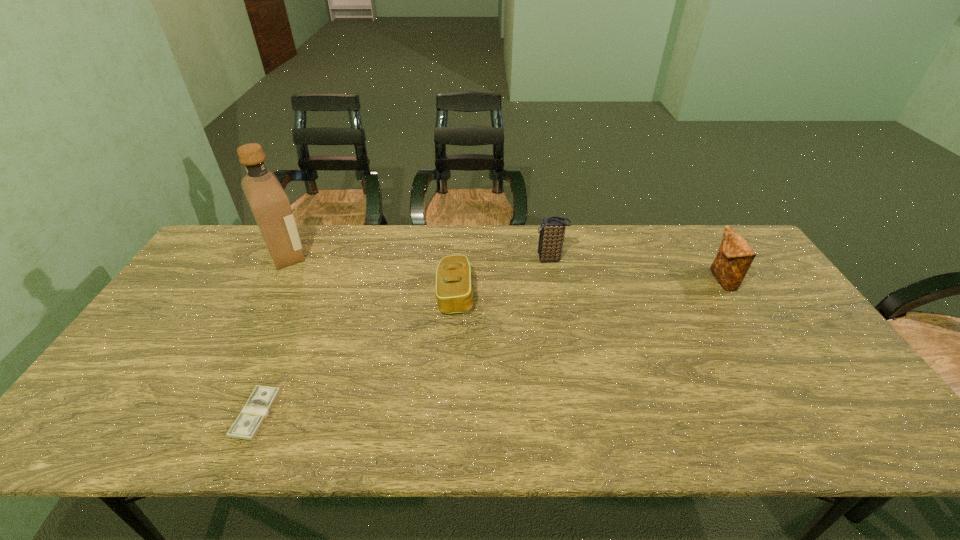
Locate an element on the screen. The width and height of the screenshot is (960, 540). vacant space situated with the zip open on the second object from right to left is located at coordinates (514, 259).

You are a GUI agent. You are given a task and a screenshot of the screen. Output one action in this format:
    pyautogui.click(x=<x>, y=<y>)
    Task: Click on the vacant point located 0.290m with the zip open on the second object from right to left
    This screenshot has height=540, width=960.
    Given the screenshot: What is the action you would take?
    pyautogui.click(x=445, y=259)

The height and width of the screenshot is (540, 960). I want to click on free space located 0.390m with the zip open on the second object from right to left, so click(415, 259).

The width and height of the screenshot is (960, 540). What are the coordinates of `blank space located on the open side of the rightmost object` in the screenshot? It's located at (581, 281).

Identify the location of vacant space located 0.080m on the open side of the rightmost object. The height and width of the screenshot is (540, 960). pyautogui.click(x=685, y=281).

Locate an element on the screen. vacant area located on the open side of the rightmost object is located at coordinates (660, 281).

Find the location of a particular element. The width and height of the screenshot is (960, 540). vacant space situated on the zipper side of the third object from right to left is located at coordinates (586, 295).

The height and width of the screenshot is (540, 960). Find the location of `vacant space located 0.140m on the right of the shortest object`. vacant space located 0.140m on the right of the shortest object is located at coordinates (334, 414).

The width and height of the screenshot is (960, 540). Identify the location of liquor that is at the far edge. (270, 205).

This screenshot has height=540, width=960. In order to click on object at the near edge in this screenshot , I will do (x=262, y=399).